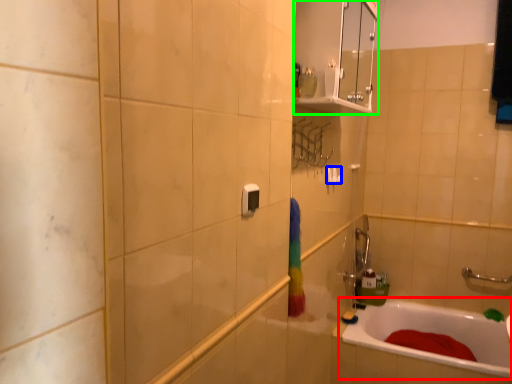
Question: Which object is positioned closest to bathtub (highlighted by a red box)? Select from towel bar (highlighted by a blue box) and medicine cabinet (highlighted by a green box).

Choices:
 (A) towel bar
 (B) medicine cabinet

Answer: (A)